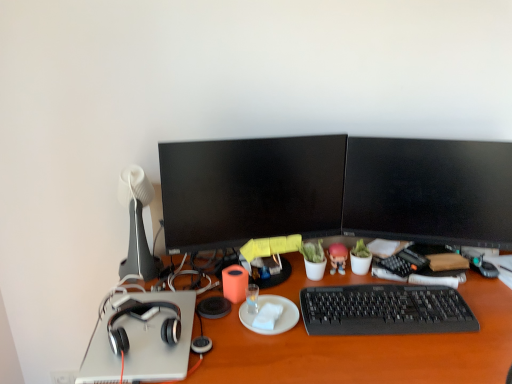
Identify the location of free location in front of black matte headphones at left. (134, 364).